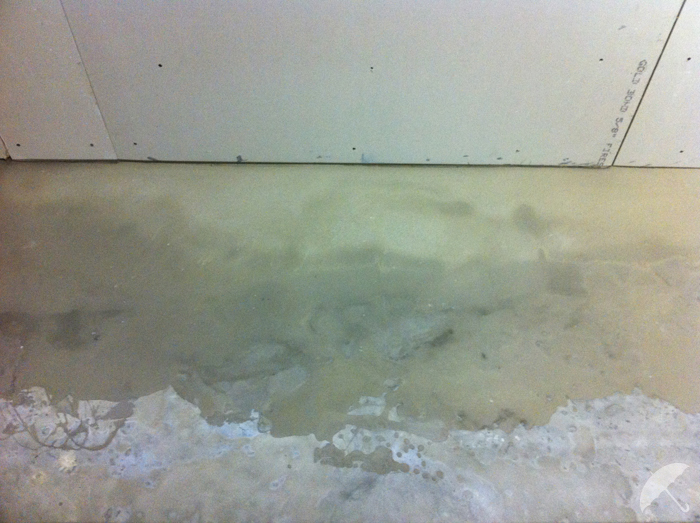
In order to click on wall in this screenshot , I will do coord(412,112).